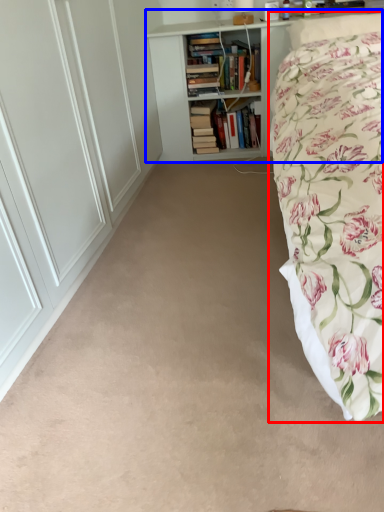
Question: Which of the following is the closest to the observer, bed (highlighted by a red box) or bookcase (highlighted by a blue box)?

Choices:
 (A) bed
 (B) bookcase

Answer: (A)